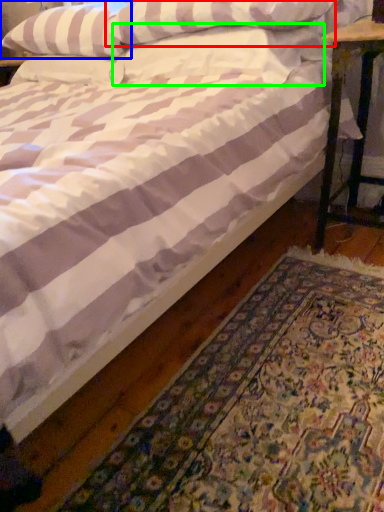
Question: Based on their relative distances, which object is farther from pillow (highlighted by a red box)? Choose from pillow (highlighted by a blue box) and pillow (highlighted by a green box).

Choices:
 (A) pillow
 (B) pillow

Answer: (A)